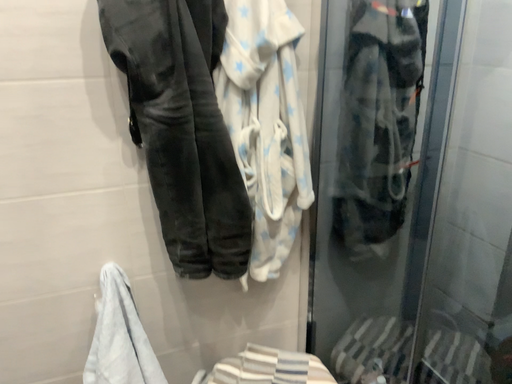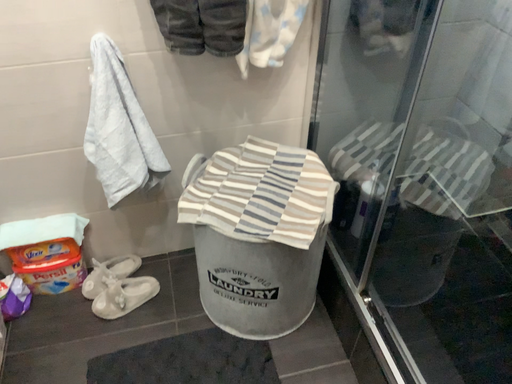
Question: Which way did the camera rotate in the video?

Choices:
 (A) rotated downward
 (B) rotated upward

Answer: (A)